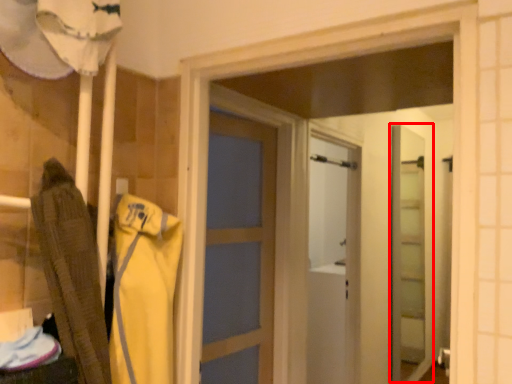
Question: From the image's perspective, what is the correct spatial relationship of screen door (annotated by the red box) in relation to clothing?

Choices:
 (A) above
 (B) below

Answer: (B)